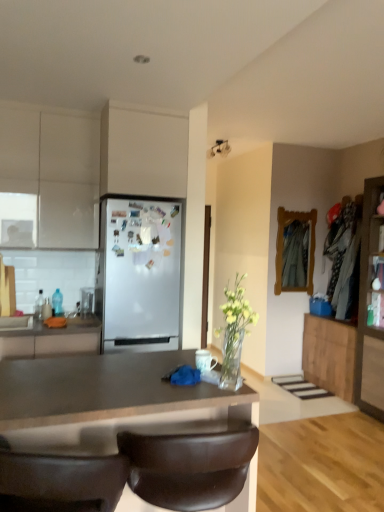
Find the location of a particular element. This screenshot has width=384, height=512. free spot above matte brown countertop at center (from a real-world perspective) is located at coordinates (117, 371).